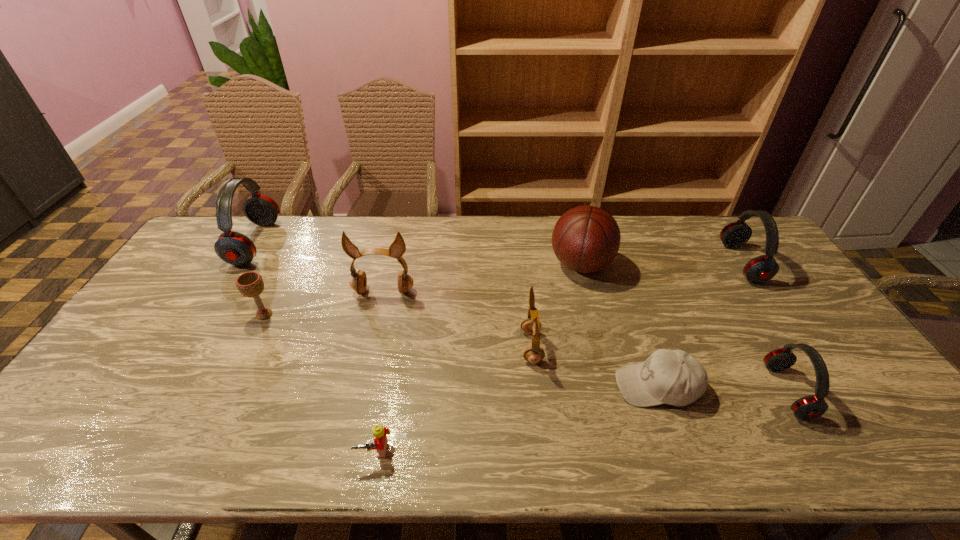
Where is `the smallest red earphone`? The height and width of the screenshot is (540, 960). the smallest red earphone is located at coordinates (809, 407).

The image size is (960, 540). What are the coordinates of `the second object from left to right` in the screenshot? It's located at (250, 284).

The width and height of the screenshot is (960, 540). Find the location of `beige chalice`. beige chalice is located at coordinates (250, 284).

Identify the location of baseball cap. Image resolution: width=960 pixels, height=540 pixels. (674, 377).

At what (x,y) coordinates should I click in order to perform the action: click on the nearest object. Please return your answer as a coordinate pair (x, y). Looking at the image, I should click on (379, 432).

You are a GUI agent. You are given a task and a screenshot of the screen. Output one action in this format:
    pyautogui.click(x=<x>, y=<y>)
    Task: Click on the vacant space located 0.360m on the ear cups of the leftmost object
    This screenshot has height=540, width=960.
    Given the screenshot: What is the action you would take?
    [x=374, y=243]

Locate an element on the screen. The height and width of the screenshot is (540, 960). vacant space located 0.150m on the front-facing side of the left brown earphone is located at coordinates (372, 338).

This screenshot has width=960, height=540. I want to click on vacant space situated 0.250m on the front of the brown basketball, so click(x=603, y=349).

Locate an element on the screen. Image resolution: width=960 pixels, height=540 pixels. free space located on the ear cups of the rightmost earphone is located at coordinates (668, 263).

The height and width of the screenshot is (540, 960). In order to click on blank space located on the ear cups of the rightmost earphone in this screenshot , I will do `click(623, 263)`.